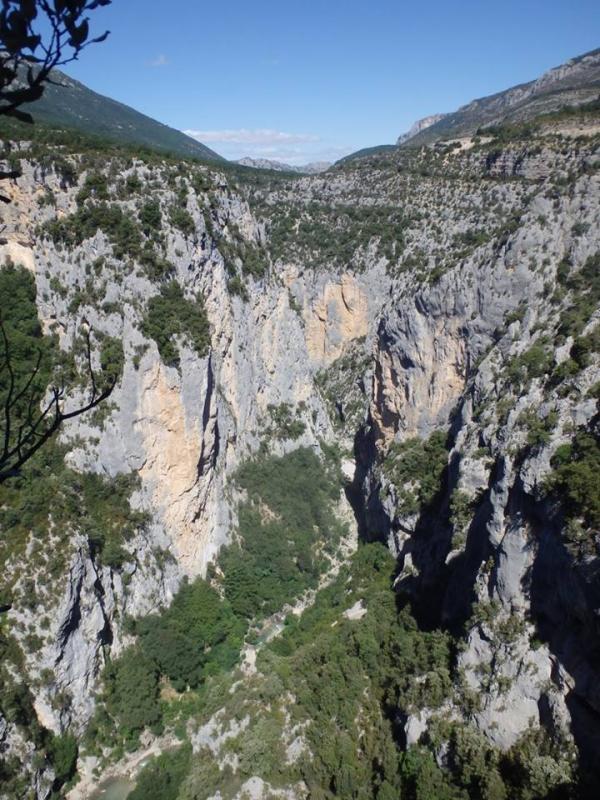
At what (x,y) coordinates should I click in order to perform the action: click on ledge. Please return your answer as a coordinate pair (x, y). Looking at the image, I should click on (464, 174), (57, 193).